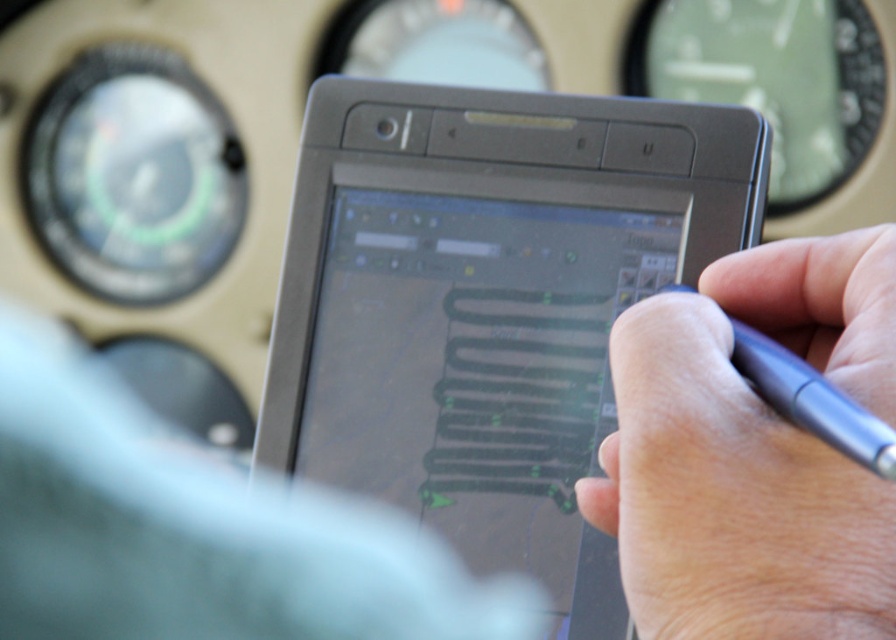
You are a pilot preparing for a flight and need to access the navigation map on your tablet. The tablet has a black bezel with buttons at the top. Where should you place your hand to interact with the white matte pen at center?

The white matte pen at center is located at point (x=752, y=451), so you should place your hand at that coordinate to interact with it.

You are a pilot preparing for a flight and need to place both the black matte tablet at center and the white matte pen at center into a storage compartment. The compartment has a height limit of 10 cm. Can you fit both items vertically without exceeding the height limit?

The black matte tablet at center is taller than the white matte pen at center. Since the compartment has a height limit of 10 cm, we need to know the exact heights of both items. However, the description only states their relative sizes. Without specific measurements, it is impossible to determine if they will fit within the 10 cm limit.

You are a pilot preparing for a flight and need to use a pen to mark the flight path on the tablet. You see a white matte pen at center and a metallic blue pen at right. Which pen is located below the other?

The white matte pen at center is positioned under the metallic blue pen at right, so the white matte pen is below the metallic blue pen.